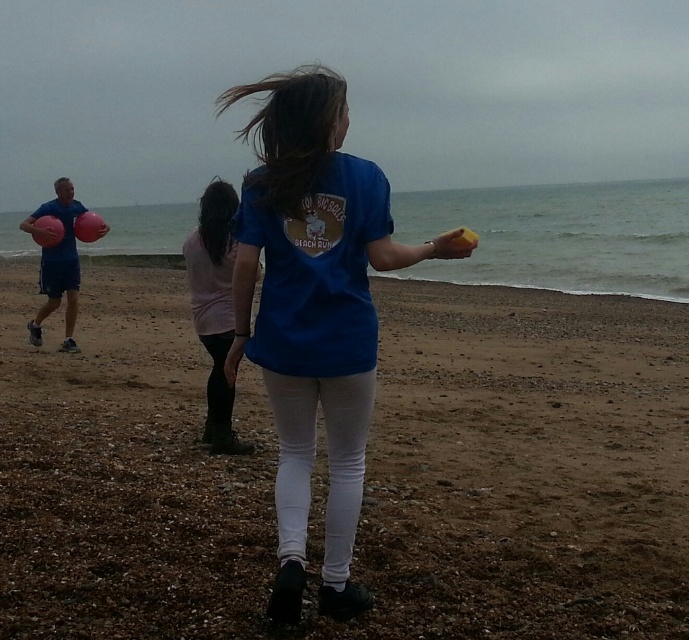
Question: Observing the image, what is the correct spatial positioning of brown sandy beach at center in reference to pink fabric shirt at center?

Choices:
 (A) below
 (B) above

Answer: (A)

Question: Estimate the real-world distances between objects in this image. Which object is farther from the blue matte t-shirt at center?

Choices:
 (A) pink fabric shirt at center
 (B) brown sandy beach at center

Answer: (A)

Question: Does blue matte t-shirt at center appear under pink fabric shirt at center?

Choices:
 (A) no
 (B) yes

Answer: (A)

Question: Which of the following is the farthest from the observer?

Choices:
 (A) coord(145,605)
 (B) coord(344,316)

Answer: (A)

Question: Which object appears closest to the camera in this image?

Choices:
 (A) blue matte t-shirt at center
 (B) pink fabric shirt at center

Answer: (A)

Question: Does brown sandy beach at center appear on the right side of pink fabric shirt at center?

Choices:
 (A) yes
 (B) no

Answer: (A)